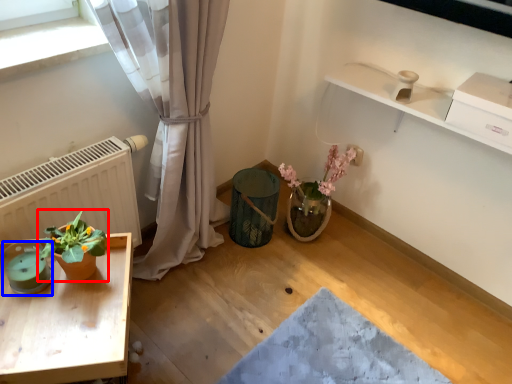
Question: Which of the following is the farthest to the observer, houseplant (highlighted by a red box) or teal (highlighted by a blue box)?

Choices:
 (A) houseplant
 (B) teal

Answer: (B)